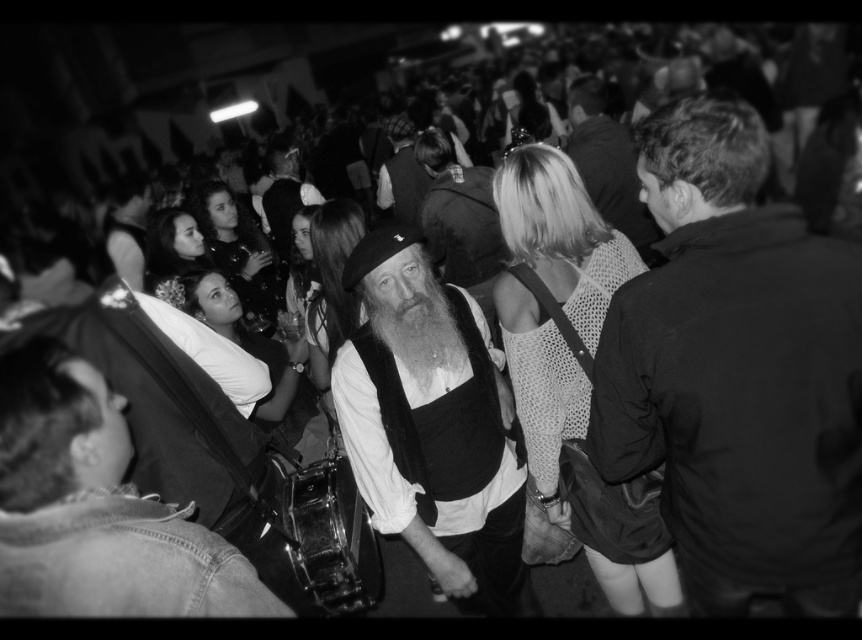
Consider the image. You are at a concert and want to compare the jackets of two people in the center of the image. Which one is shorter between the dark fabric jacket at center and the smooth leather jacket at center?

The dark fabric jacket at center is shorter than the smooth leather jacket at center.